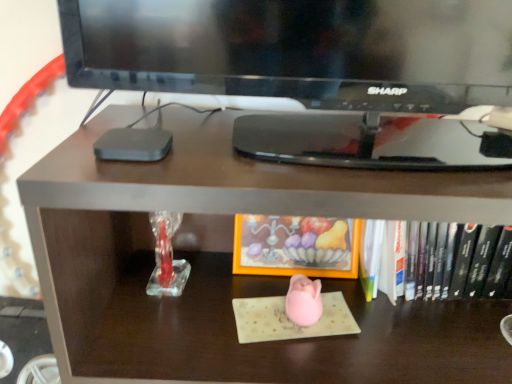
Question: From the image's perspective, is matte brown desk at center located beneath orange matte frame at center, acting as the second book starting from the right?

Choices:
 (A) yes
 (B) no

Answer: (A)

Question: Is matte brown desk at center wider than orange matte frame at center, which is counted as the 1th book, starting from the left?

Choices:
 (A) no
 (B) yes

Answer: (B)

Question: Considering the relative sizes of matte brown desk at center and orange matte frame at center, which is counted as the 1th book, starting from the left, in the image provided, is matte brown desk at center taller than orange matte frame at center, which is counted as the 1th book, starting from the left,?

Choices:
 (A) yes
 (B) no

Answer: (A)

Question: Considering the relative positions of matte brown desk at center and orange matte frame at center, which is counted as the 1th book, starting from the left, in the image provided, is matte brown desk at center to the right of orange matte frame at center, which is counted as the 1th book, starting from the left, from the viewer's perspective?

Choices:
 (A) yes
 (B) no

Answer: (A)

Question: Can you confirm if matte brown desk at center is positioned to the left of orange matte frame at center, which is counted as the 1th book, starting from the left?

Choices:
 (A) no
 (B) yes

Answer: (A)

Question: From their relative heights in the image, would you say hardcover book at center, which appears as the first book when viewed from the right, is taller or shorter than orange matte frame at center, which is counted as the 1th book, starting from the left?

Choices:
 (A) short
 (B) tall

Answer: (A)

Question: Considering the positions of hardcover book at center, which is the 2th book from left to right, and orange matte frame at center, which is counted as the 1th book, starting from the left, in the image, is hardcover book at center, which is the 2th book from left to right, wider or thinner than orange matte frame at center, which is counted as the 1th book, starting from the left,?

Choices:
 (A) thin
 (B) wide

Answer: (B)

Question: From a real-world perspective, is hardcover book at center, which is the 2th book from left to right, positioned above or below orange matte frame at center, which is counted as the 1th book, starting from the left?

Choices:
 (A) above
 (B) below

Answer: (B)

Question: Is point (414, 279) positioned closer to the camera than point (350, 264)?

Choices:
 (A) farther
 (B) closer

Answer: (B)

Question: Choose the correct answer: Is matte brown desk at center inside orange matte frame at center, which is counted as the 1th book, starting from the left, or outside it?

Choices:
 (A) outside
 (B) inside

Answer: (A)

Question: Considering the positions of matte brown desk at center and orange matte frame at center, which is counted as the 1th book, starting from the left, in the image, is matte brown desk at center wider or thinner than orange matte frame at center, which is counted as the 1th book, starting from the left,?

Choices:
 (A) wide
 (B) thin

Answer: (A)

Question: Based on their sizes in the image, would you say matte brown desk at center is bigger or smaller than orange matte frame at center, acting as the second book starting from the right?

Choices:
 (A) big
 (B) small

Answer: (A)

Question: Considering the positions of matte brown desk at center and orange matte frame at center, acting as the second book starting from the right, in the image, is matte brown desk at center taller or shorter than orange matte frame at center, acting as the second book starting from the right,?

Choices:
 (A) short
 (B) tall

Answer: (B)

Question: Considering the positions of matte brown desk at center and hardcover book at center, which appears as the first book when viewed from the right, in the image, is matte brown desk at center taller or shorter than hardcover book at center, which appears as the first book when viewed from the right,?

Choices:
 (A) tall
 (B) short

Answer: (A)

Question: In terms of size, does matte brown desk at center appear bigger or smaller than hardcover book at center, which appears as the first book when viewed from the right?

Choices:
 (A) big
 (B) small

Answer: (A)